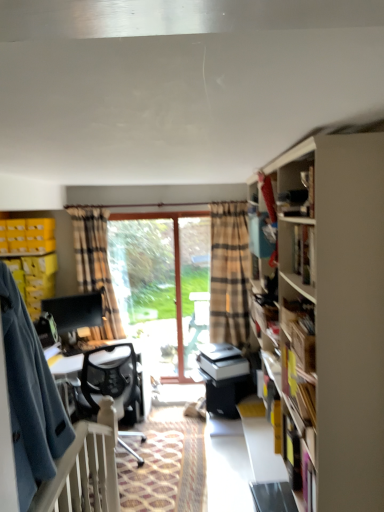
Question: From the image's perspective, is yellow plastic crate at left, the second cabinet ordered from the bottom, located above or below matte black bookshelf at upper right?

Choices:
 (A) below
 (B) above

Answer: (A)

Question: Is yellow plastic crate at left, the second cabinet ordered from the bottom, wider or thinner than matte black bookshelf at upper right?

Choices:
 (A) thin
 (B) wide

Answer: (B)

Question: Estimate the real-world distances between objects in this image. Which object is closer to the transparent glass door at center?

Choices:
 (A) yellow plastic crate at left, which ranks as the first cabinet in top-to-bottom order
 (B) white plastic balustrade at lower left
 (C) plaid fabric curtain at center
 (D) transparent glass screen door at center
 (E) matte black bookshelf at upper right

Answer: (D)

Question: Which object is the farthest from the white plastic balustrade at lower left?

Choices:
 (A) transparent glass door at center
 (B) white mesh chair at center
 (C) plaid fabric curtain at center
 (D) transparent glass screen door at center
 (E) matte black cabinet at left, which ranks as the first cabinet in bottom-to-top order

Answer: (A)